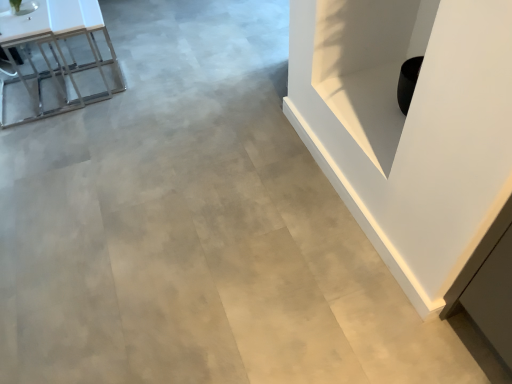
The height and width of the screenshot is (384, 512). Identify the location of free space to the back side of metallic silver chair at left. (60, 58).